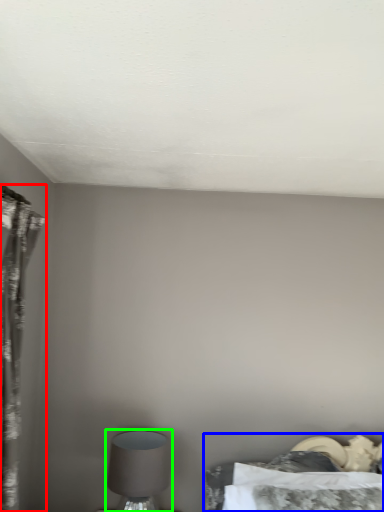
Question: Estimate the real-world distances between objects in this image. Which object is closer to curtain (highlighted by a red box), bed (highlighted by a blue box) or table lamp (highlighted by a green box)?

Choices:
 (A) bed
 (B) table lamp

Answer: (B)